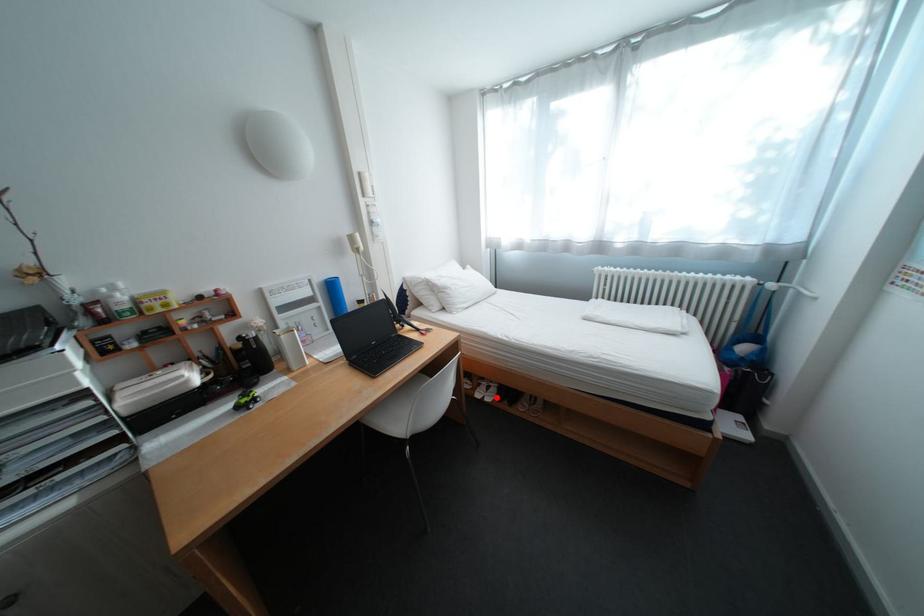
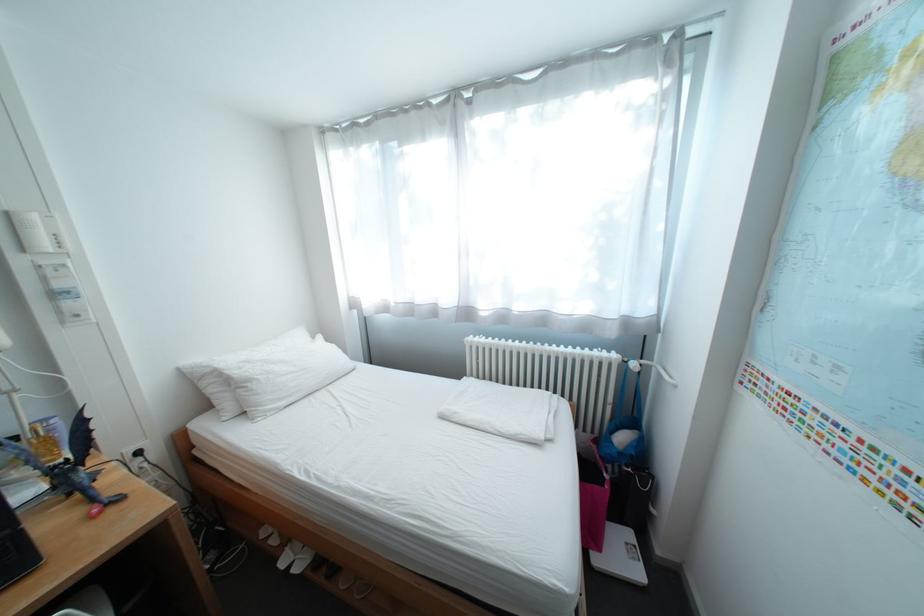
Question: I am providing you with two images of the same scene from different viewpoints. In image1, a red point is highlighted. Considering the same 3D point in image2, which of the following is correct?

Choices:
 (A) It is closer
 (B) It is farther

Answer: (A)